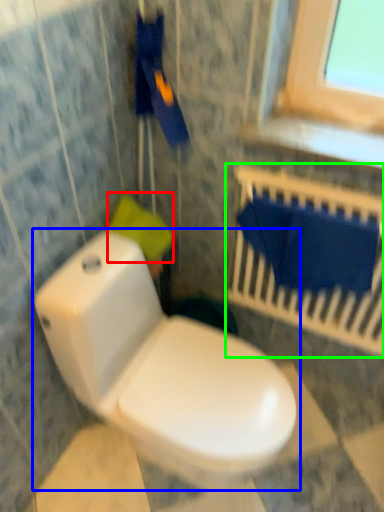
Question: Which object is positioned farthest from toilet paper (highlighted by a red box)? Select from toilet (highlighted by a blue box) and balustrade (highlighted by a green box).

Choices:
 (A) toilet
 (B) balustrade

Answer: (B)